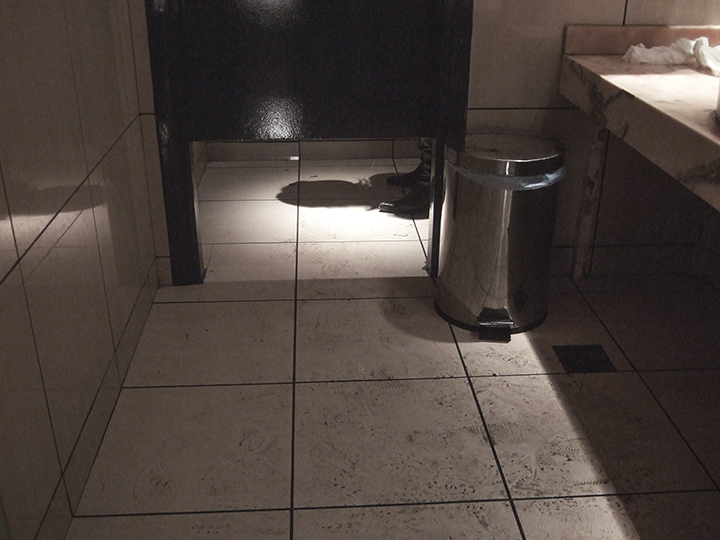
I want to click on counter top, so click(x=669, y=101).